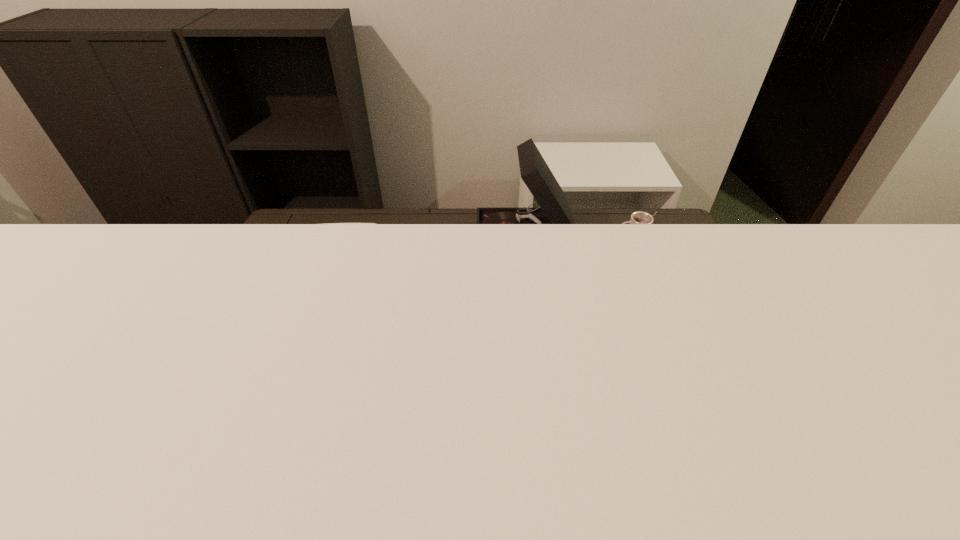
The width and height of the screenshot is (960, 540). Identify the location of vacant space that's between the second tallest object and the second object from left to right. (432, 269).

Identify which object is located as the nearest to the phonograph_record. Please provide its 2D coordinates. Your answer should be formatted as a tuple, i.e. [(x, y)], where the tuple contains the x and y coordinates of a point satisfying the conditions above.

[(326, 223)]

Image resolution: width=960 pixels, height=540 pixels. I want to click on object that can be found as the closest to the phonograph_record, so click(x=326, y=223).

Locate an element on the screen. Image resolution: width=960 pixels, height=540 pixels. vacant space that satisfies the following two spatial constraints: 1. on the side with the handle of the rightmost object; 2. on the front side of the leftmost object is located at coordinates (655, 295).